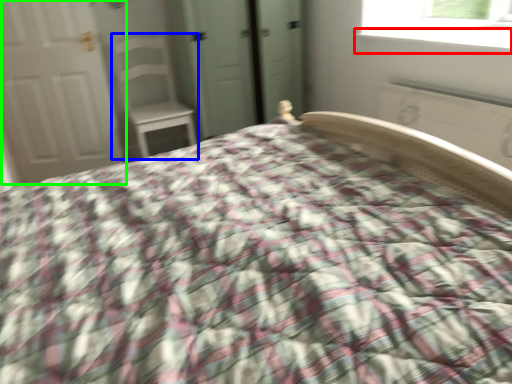
Question: Based on their relative distances, which object is nearer to window sill (highlighted by a red box)? Choose from chair (highlighted by a blue box) and door (highlighted by a green box).

Choices:
 (A) chair
 (B) door

Answer: (A)